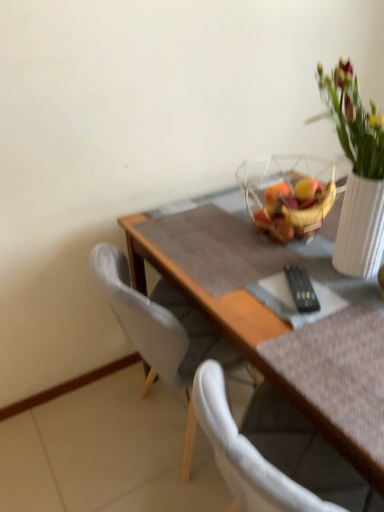
Question: Is translucent glass bowl at upper center outside transparent glass bowl at upper right?

Choices:
 (A) yes
 (B) no

Answer: (B)

Question: Is there a large distance between translucent glass bowl at upper center and transparent glass bowl at upper right?

Choices:
 (A) yes
 (B) no

Answer: (B)

Question: From the image's perspective, is translucent glass bowl at upper center located beneath transparent glass bowl at upper right?

Choices:
 (A) yes
 (B) no

Answer: (B)

Question: Considering the relative sizes of translucent glass bowl at upper center and transparent glass bowl at upper right in the image provided, is translucent glass bowl at upper center thinner than transparent glass bowl at upper right?

Choices:
 (A) yes
 (B) no

Answer: (A)

Question: Can you confirm if translucent glass bowl at upper center is taller than transparent glass bowl at upper right?

Choices:
 (A) no
 (B) yes

Answer: (A)

Question: Would you say transparent glass bowl at upper right is to the left or to the right of white fabric chair at left in the picture?

Choices:
 (A) right
 (B) left

Answer: (A)

Question: Is transparent glass bowl at upper right wider or thinner than white fabric chair at left?

Choices:
 (A) thin
 (B) wide

Answer: (A)

Question: Would you say transparent glass bowl at upper right is inside or outside white fabric chair at left?

Choices:
 (A) outside
 (B) inside

Answer: (A)

Question: From a real-world perspective, relative to white fabric chair at left, is transparent glass bowl at upper right vertically above or below?

Choices:
 (A) below
 (B) above

Answer: (B)

Question: Considering the positions of transparent glass bowl at upper right and translucent glass bowl at upper center in the image, is transparent glass bowl at upper right bigger or smaller than translucent glass bowl at upper center?

Choices:
 (A) small
 (B) big

Answer: (B)

Question: Is point (284, 174) positioned closer to the camera than point (299, 182)?

Choices:
 (A) closer
 (B) farther

Answer: (B)

Question: From a real-world perspective, is transparent glass bowl at upper right above or below translucent glass bowl at upper center?

Choices:
 (A) above
 (B) below

Answer: (B)

Question: Would you say transparent glass bowl at upper right is to the left or to the right of translucent glass bowl at upper center in the picture?

Choices:
 (A) left
 (B) right

Answer: (A)

Question: From a real-world perspective, is wooden table at center physically located above or below translucent glass bowl at upper center?

Choices:
 (A) above
 (B) below

Answer: (B)

Question: In the image, is wooden table at center positioned in front of or behind translucent glass bowl at upper center?

Choices:
 (A) front
 (B) behind

Answer: (A)